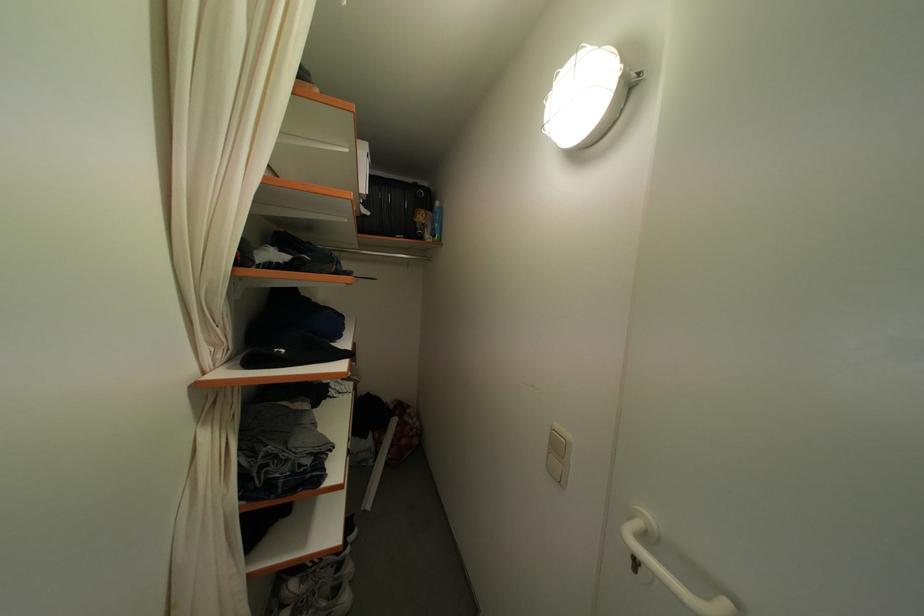
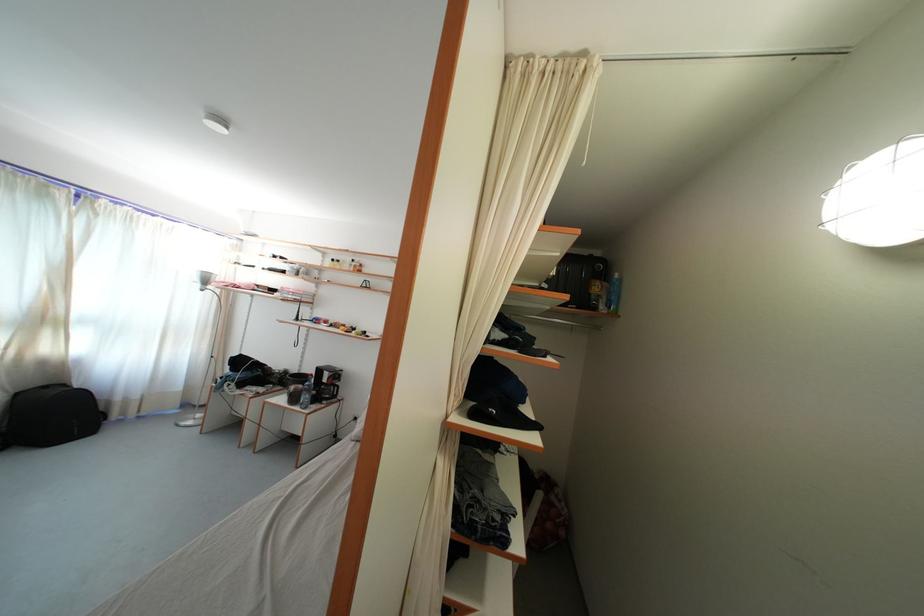
In the second image, find the point that corresponds to pixel 440 243 in the first image.

(615, 314)